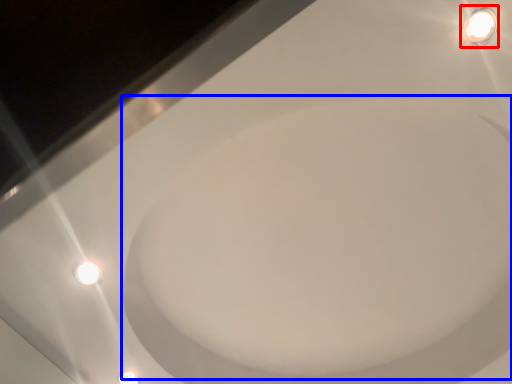
Question: Among these objects, which one is farthest to the camera, light fixture (highlighted by a red box) or bath (highlighted by a blue box)?

Choices:
 (A) light fixture
 (B) bath

Answer: (B)